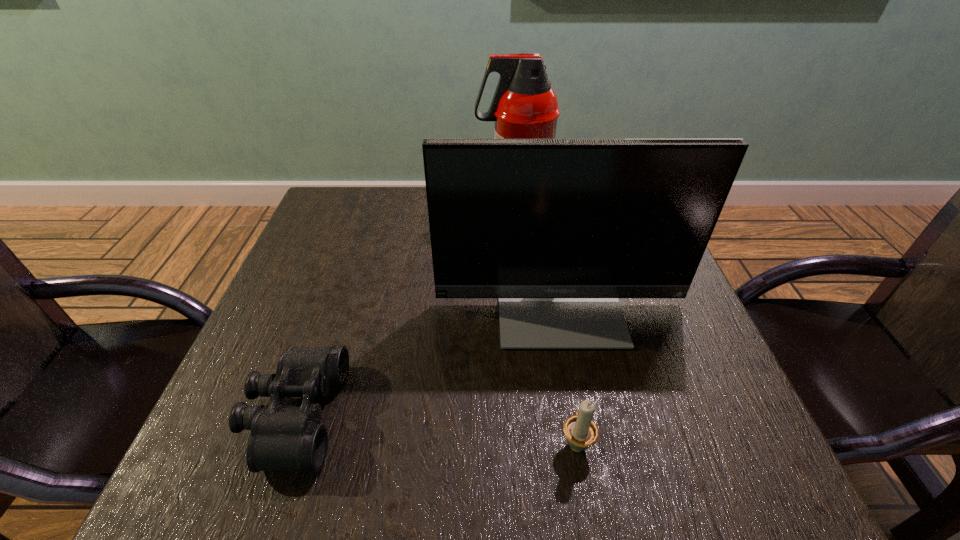
Locate an element on the screen. This screenshot has height=540, width=960. vacant space that satisfies the following two spatial constraints: 1. on the handle side of the candle_holder; 2. on the trigger side of the fire extinguisher is located at coordinates (537, 209).

Identify the location of free space that satisfies the following two spatial constraints: 1. on the handle side of the second shortest object; 2. on the trigger side of the fire extinguisher. (537, 209).

Locate an element on the screen. free spot that satisfies the following two spatial constraints: 1. on the screen of the third nearest object; 2. at the eyepieces of the binoculars is located at coordinates (579, 415).

Where is `free region that satisfies the following two spatial constraints: 1. on the trigger side of the fire extinguisher; 2. on the handle side of the third tallest object`? This screenshot has width=960, height=540. free region that satisfies the following two spatial constraints: 1. on the trigger side of the fire extinguisher; 2. on the handle side of the third tallest object is located at coordinates (535, 442).

At what (x,y) coordinates should I click in order to perform the action: click on blank area in the image that satisfies the following two spatial constraints: 1. on the screen of the computer monitor; 2. at the eyepieces of the leftmost object. Please return your answer as a coordinate pair (x, y). The height and width of the screenshot is (540, 960). Looking at the image, I should click on (579, 415).

Where is `free space that satisfies the following two spatial constraints: 1. on the handle side of the second shortest object; 2. on the trigger side of the fire extinguisher`? This screenshot has width=960, height=540. free space that satisfies the following two spatial constraints: 1. on the handle side of the second shortest object; 2. on the trigger side of the fire extinguisher is located at coordinates (537, 209).

At what (x,y) coordinates should I click in order to perform the action: click on vacant area that satisfies the following two spatial constraints: 1. on the handle side of the second shortest object; 2. on the trigger side of the fire extinguisher. Please return your answer as a coordinate pair (x, y). Looking at the image, I should click on (537, 209).

Find the location of a particular element. This screenshot has height=540, width=960. free space that satisfies the following two spatial constraints: 1. on the trigger side of the fire extinguisher; 2. on the handle side of the second shortest object is located at coordinates (535, 442).